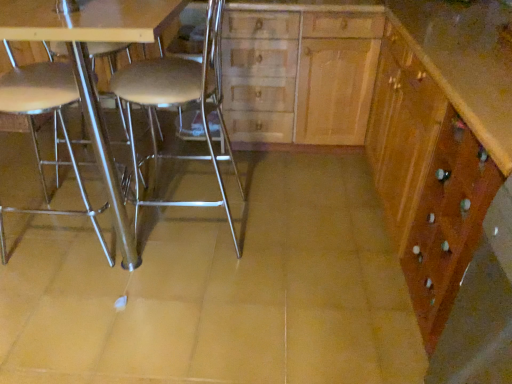
You are a GUI agent. You are given a task and a screenshot of the screen. Output one action in this format:
    pyautogui.click(x=<x>, y=<y>)
    Task: Click on the vacant space that is in between metallic silver stool at center, the first chair from the right, and metallic silver chair at left, arranged as the second chair when viewed from the right
    Image resolution: width=512 pixels, height=384 pixels.
    Given the screenshot: What is the action you would take?
    pyautogui.click(x=156, y=239)